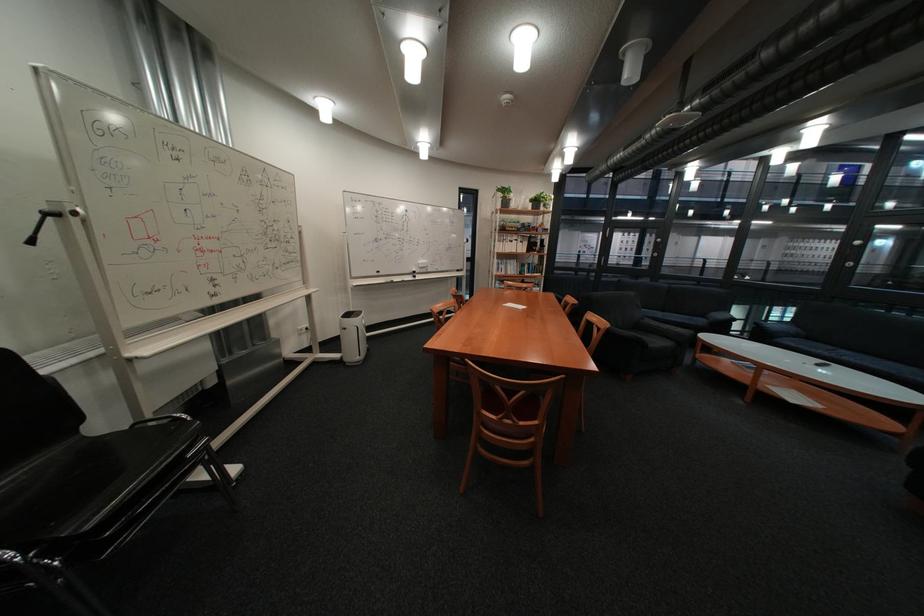
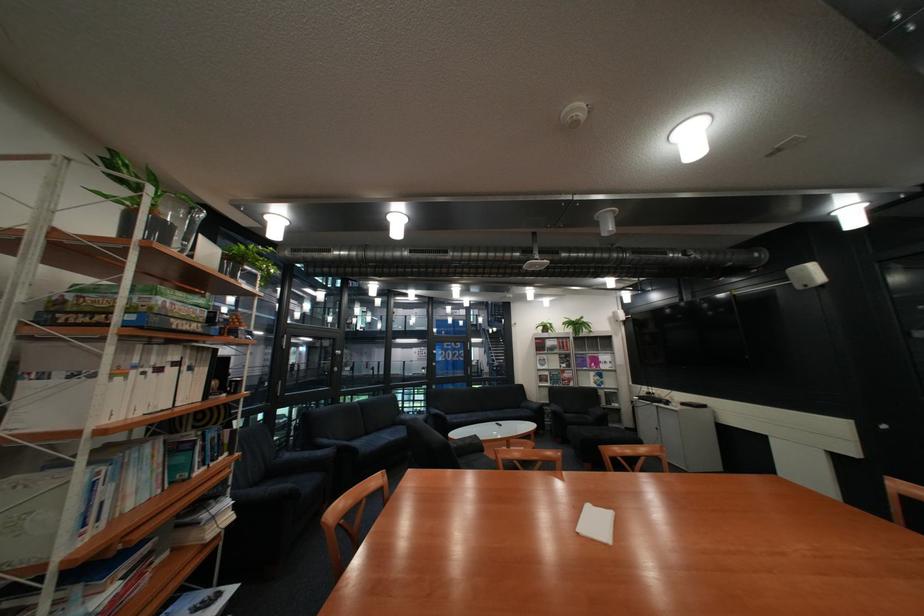
The point at (515, 227) is marked in the first image. Where is the corresponding point in the second image?

(141, 312)